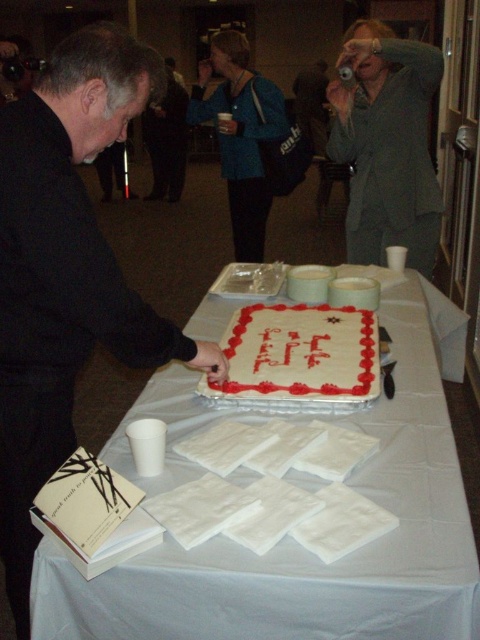
The width and height of the screenshot is (480, 640). Find the location of `white paper napkins at center`. white paper napkins at center is located at coordinates (305, 550).

Is the position of white paper napkins at center more distant than that of black matte jacket at center?

That is False.

The image size is (480, 640). I want to click on white paper napkins at center, so click(305, 550).

Where is `white paper napkins at center`? The height and width of the screenshot is (640, 480). white paper napkins at center is located at coordinates (305, 550).

Which is in front, point (142, 92) or point (375, 83)?

Positioned in front is point (142, 92).

Based on the photo, is black matte jacket at center shorter than gray wool sweater at upper right?

No, black matte jacket at center is not shorter than gray wool sweater at upper right.

Who is more forward, (91, 29) or (385, 106)?

Point (91, 29) is in front.

Identify the location of black matte jacket at center. Image resolution: width=480 pixels, height=640 pixels. (66, 273).

How distant is white paper napkins at center from gray wool sweater at upper right?

They are 1.06 meters apart.

What do you see at coordinates (305, 550) in the screenshot?
I see `white paper napkins at center` at bounding box center [305, 550].

The height and width of the screenshot is (640, 480). Find the location of `white paper napkins at center`. white paper napkins at center is located at coordinates (305, 550).